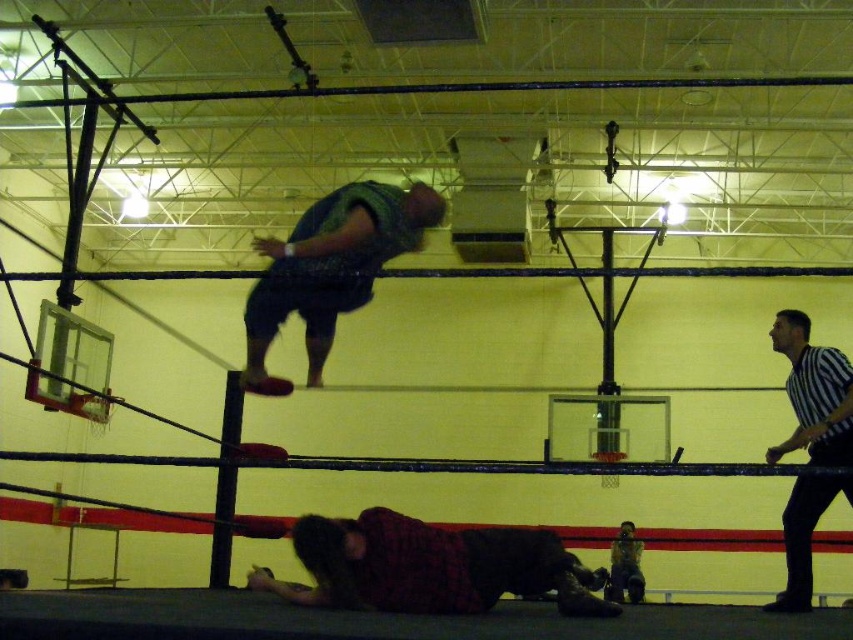
Question: Which object appears closest to the camera in this image?

Choices:
 (A) plaid shirt at lower center
 (B) green textured shirt at upper center

Answer: (B)

Question: Is plaid shirt at lower center to the left of black striped shirt at right from the viewer's perspective?

Choices:
 (A) no
 (B) yes

Answer: (B)

Question: Which of the following is the farthest from the observer?

Choices:
 (A) (830, 396)
 (B) (408, 224)

Answer: (A)

Question: Does plaid shirt at lower center appear on the right side of black striped shirt at right?

Choices:
 (A) yes
 (B) no

Answer: (B)

Question: Which object is farther from the camera taking this photo?

Choices:
 (A) green textured shirt at upper center
 (B) plaid shirt at lower center

Answer: (B)

Question: Is green textured shirt at upper center wider than black striped shirt at right?

Choices:
 (A) yes
 (B) no

Answer: (A)